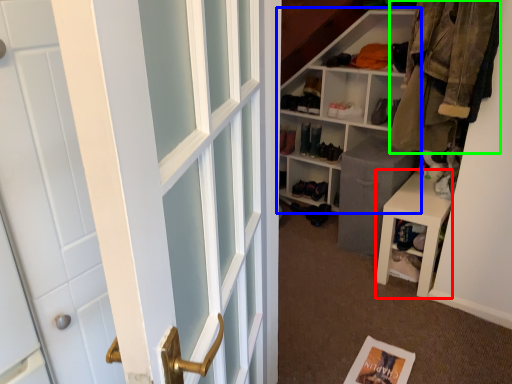
Question: Considering the real-world distances, which object is closest to stool (highlighted by a red box)? shelf (highlighted by a blue box) or clothing (highlighted by a green box).

Choices:
 (A) shelf
 (B) clothing

Answer: (B)